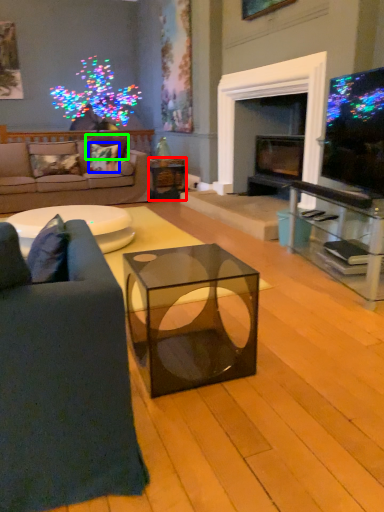
Question: Considering the real-world distances, which object is closest to side table (highlighted by a red box)? pillow (highlighted by a blue box) or pillow (highlighted by a green box).

Choices:
 (A) pillow
 (B) pillow

Answer: (A)